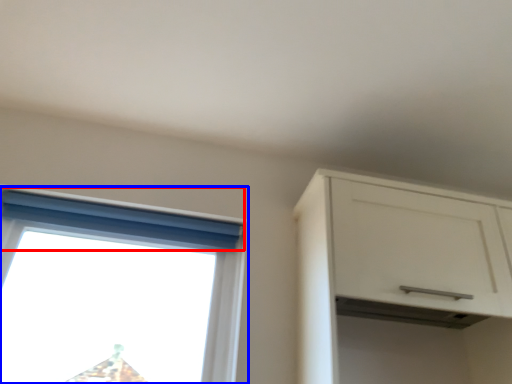
Question: Among these objects, which one is farthest to the camera, curtain (highlighted by a red box) or window (highlighted by a blue box)?

Choices:
 (A) curtain
 (B) window

Answer: (A)